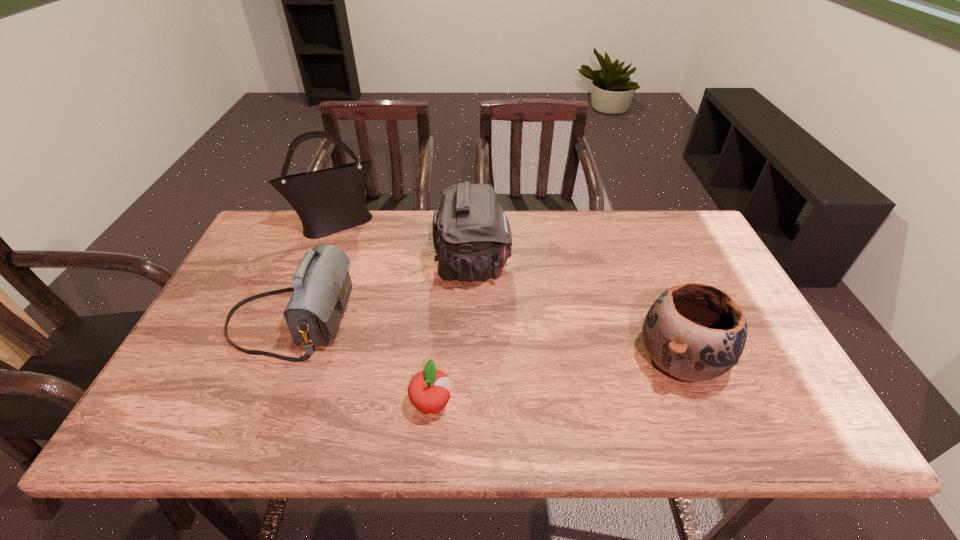
Find the location of `the farthest shoulder bag`. the farthest shoulder bag is located at coordinates (328, 201).

The image size is (960, 540). What are the coordinates of `the farthest object` in the screenshot? It's located at (328, 201).

Locate an element on the screen. This screenshot has width=960, height=540. the second tallest shoulder bag is located at coordinates (472, 238).

Find the location of `the rightmost shoulder bag`. the rightmost shoulder bag is located at coordinates (472, 238).

The width and height of the screenshot is (960, 540). I want to click on the shortest shoulder bag, so click(x=322, y=285).

Where is `pottery`? This screenshot has width=960, height=540. pottery is located at coordinates (692, 332).

This screenshot has width=960, height=540. What are the coordinates of `the shortest object` in the screenshot? It's located at (427, 390).

I want to click on free spot located 0.290m on the front of the tallest shoulder bag, so click(x=305, y=306).

At what (x,y) coordinates should I click in order to perform the action: click on vacant space located on the open flap of the second tallest object. Please return your answer as a coordinate pair (x, y). The width and height of the screenshot is (960, 540). Looking at the image, I should click on (591, 266).

Where is `vacant area situated 0.130m on the back of the shortest shoulder bag`? The width and height of the screenshot is (960, 540). vacant area situated 0.130m on the back of the shortest shoulder bag is located at coordinates (318, 254).